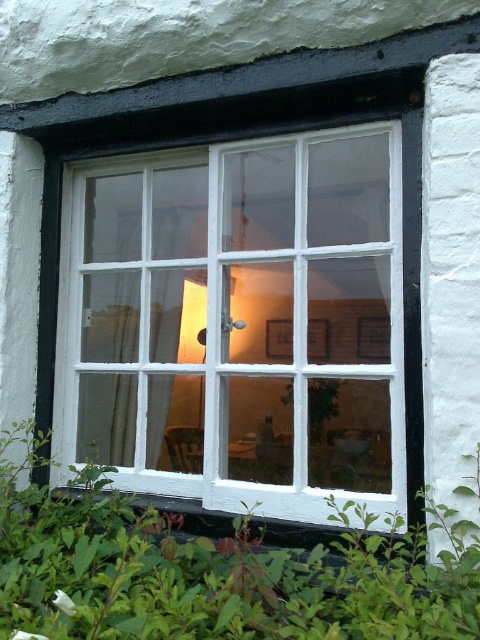
Question: Among these points, which one is farthest from the camera?

Choices:
 (A) (308, 584)
 (B) (305, 173)

Answer: (B)

Question: Which of the following is the closest to the observer?

Choices:
 (A) (88, 333)
 (B) (324, 612)

Answer: (B)

Question: Does white wooden window at center have a smaller size compared to green leafy plant at lower center?

Choices:
 (A) no
 (B) yes

Answer: (A)

Question: Does white wooden window at center come in front of green leafy plant at lower center?

Choices:
 (A) no
 (B) yes

Answer: (A)

Question: Does white wooden window at center come in front of green leafy plant at lower center?

Choices:
 (A) no
 (B) yes

Answer: (A)

Question: Which of the following is the farthest from the observer?

Choices:
 (A) white wooden window at center
 (B) green leafy plant at lower center

Answer: (A)